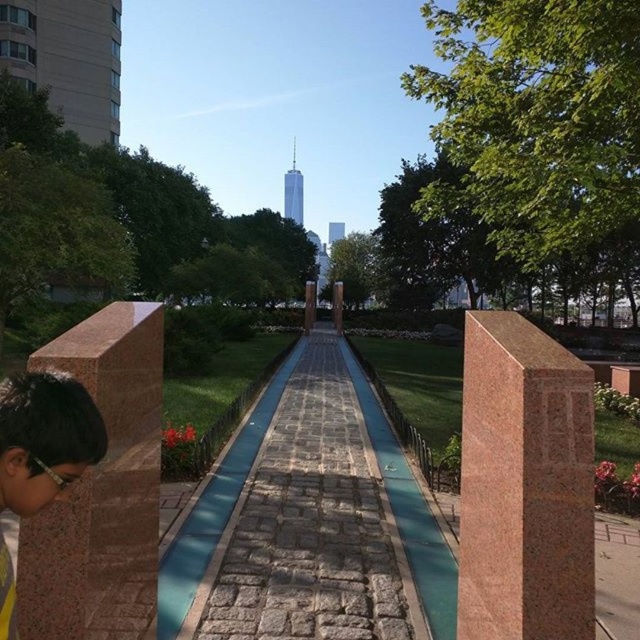
Question: Among these objects, which one is nearest to the camera?

Choices:
 (A) stone paved walkway at center
 (B) yellow fabric shirt at lower left

Answer: (B)

Question: Which point is closer to the camera taking this photo?

Choices:
 (A) [324, 589]
 (B) [35, 433]

Answer: (B)

Question: Is stone paved walkway at center bigger than yellow fabric shirt at lower left?

Choices:
 (A) yes
 (B) no

Answer: (A)

Question: Is stone paved walkway at center further to the viewer compared to yellow fabric shirt at lower left?

Choices:
 (A) no
 (B) yes

Answer: (B)

Question: Can you confirm if stone paved walkway at center is positioned above yellow fabric shirt at lower left?

Choices:
 (A) no
 (B) yes

Answer: (A)